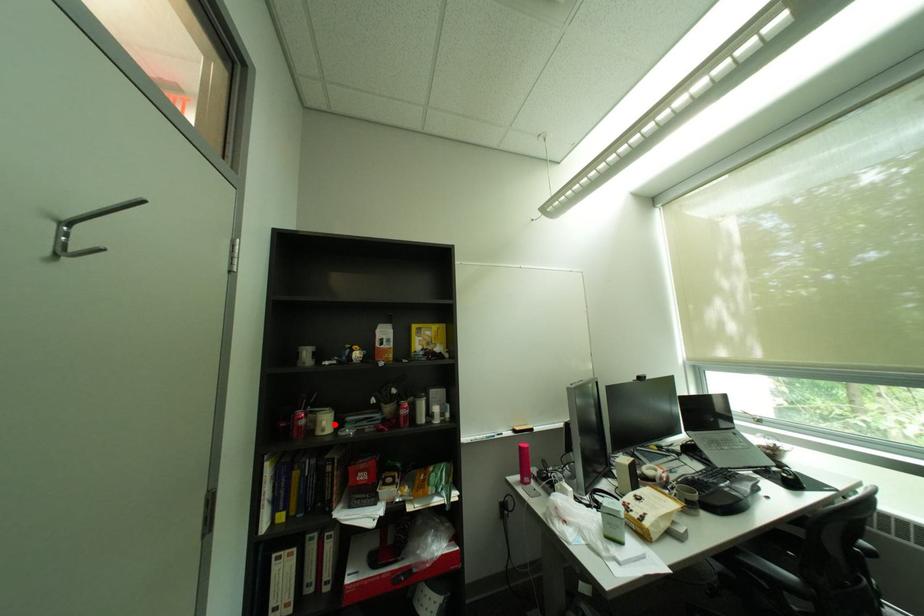
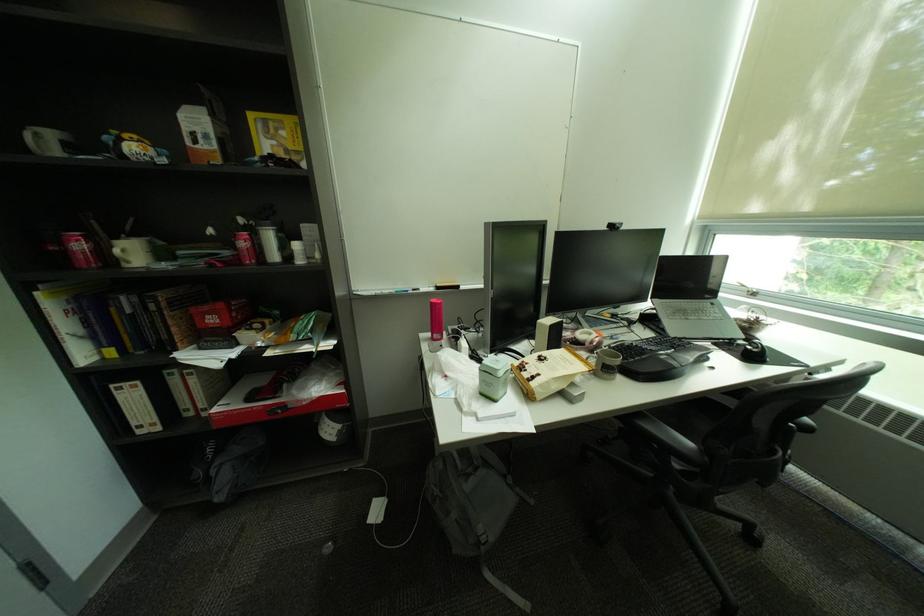
Where in the second image is the point corresponding to the highlighted location from the first image?

(128, 252)